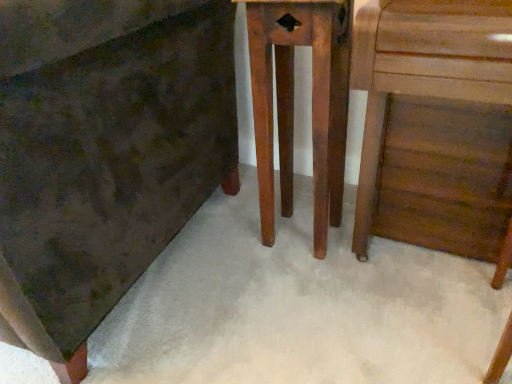
Question: From the image's perspective, relative to wooden table at center, is wooden chest of drawers at center above or below?

Choices:
 (A) below
 (B) above

Answer: (B)

Question: Considering the relative positions of wooden chest of drawers at center and wooden table at center in the image provided, is wooden chest of drawers at center to the left or to the right of wooden table at center?

Choices:
 (A) left
 (B) right

Answer: (A)

Question: From a real-world perspective, relative to wooden table at center, is wooden chest of drawers at center vertically above or below?

Choices:
 (A) below
 (B) above

Answer: (B)

Question: Based on their sizes in the image, would you say wooden table at center is bigger or smaller than wooden chest of drawers at center?

Choices:
 (A) big
 (B) small

Answer: (B)

Question: From the image's perspective, is wooden table at center positioned above or below wooden chest of drawers at center?

Choices:
 (A) below
 (B) above

Answer: (A)

Question: From a real-world perspective, is wooden table at center physically located above or below wooden chest of drawers at center?

Choices:
 (A) above
 (B) below

Answer: (B)

Question: In terms of width, does wooden table at center look wider or thinner when compared to wooden chest of drawers at center?

Choices:
 (A) wide
 (B) thin

Answer: (B)